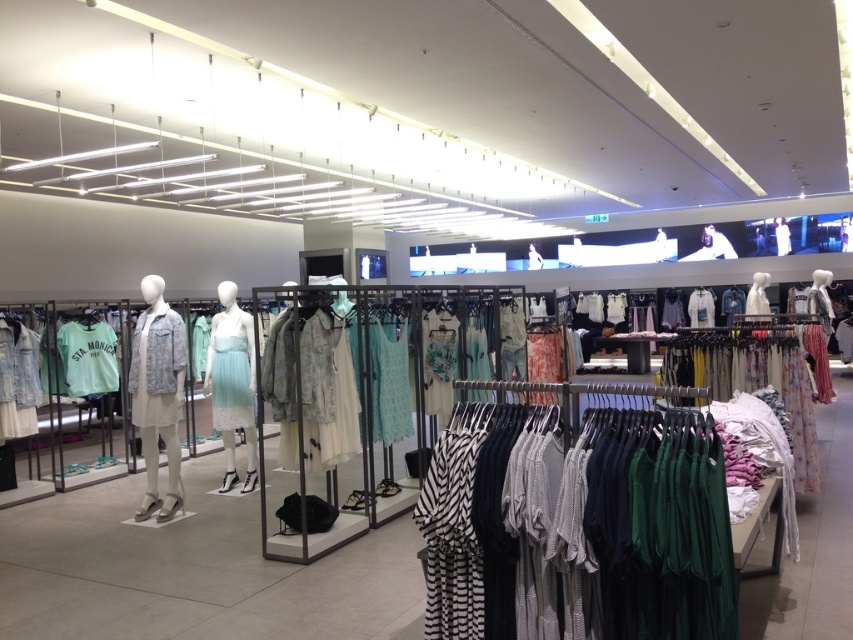
Is green jersey dress at center bigger than mint fabric dress at center?

Indeed, green jersey dress at center has a larger size compared to mint fabric dress at center.

Is point (815, 467) farther from viewer compared to point (238, 330)?

No, (815, 467) is closer to viewer.

Is point (757, 339) positioned before point (241, 342)?

Yes, it is in front of point (241, 342).

In order to click on green jersey dress at center in this screenshot , I will do `click(752, 378)`.

Which is in front, point (792, 436) or point (132, 348)?

Point (792, 436)

Is green jersey dress at center taller than floral denim jacket at center?

No.

Where is `green jersey dress at center`? green jersey dress at center is located at coordinates (752, 378).

Does striped jersey dress at center have a greater width compared to floral denim jacket at center?

Yes, striped jersey dress at center is wider than floral denim jacket at center.

The height and width of the screenshot is (640, 853). What are the coordinates of `striped jersey dress at center` in the screenshot? It's located at (659, 524).

Identify the location of striped jersey dress at center. (659, 524).